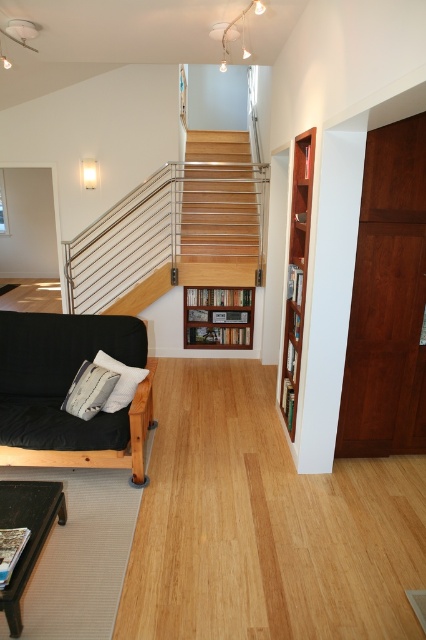
Is point (239, 321) closer to viewer compared to point (115, 374)?

No, it is not.

Which is behind, point (227, 292) or point (75, 394)?

The point (227, 292) is behind.

Is point (186, 340) in front of point (83, 417)?

No, (186, 340) is behind (83, 417).

The image size is (426, 640). In order to click on wooden bookshelf at center in this screenshot , I will do `click(218, 316)`.

Describe the element at coordinates (66, 390) in the screenshot. I see `black wood futon at lower left` at that location.

Is black wood futon at lower left positioned at the back of wooden bookshelf at right?

Yes, it is behind wooden bookshelf at right.

At what (x,y) coordinates should I click in order to perform the action: click on black wood futon at lower left. Please return your answer as a coordinate pair (x, y). This screenshot has width=426, height=640. Looking at the image, I should click on (66, 390).

Can you confirm if wooden bookshelf at right is wider than white textured pillow at lower left?

A: Incorrect, wooden bookshelf at right's width does not surpass white textured pillow at lower left's.

Does point (290, 259) lie in front of point (88, 387)?

No, (290, 259) is behind (88, 387).

Find the location of `wooden bookshelf at right`. wooden bookshelf at right is located at coordinates (296, 273).